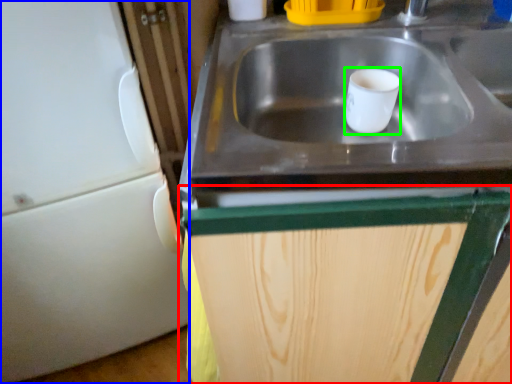
Question: Estimate the real-world distances between objects in this image. Which object is farther from cabinetry (highlighted by a red box), appliance (highlighted by a blue box) or mug (highlighted by a green box)?

Choices:
 (A) appliance
 (B) mug

Answer: (A)